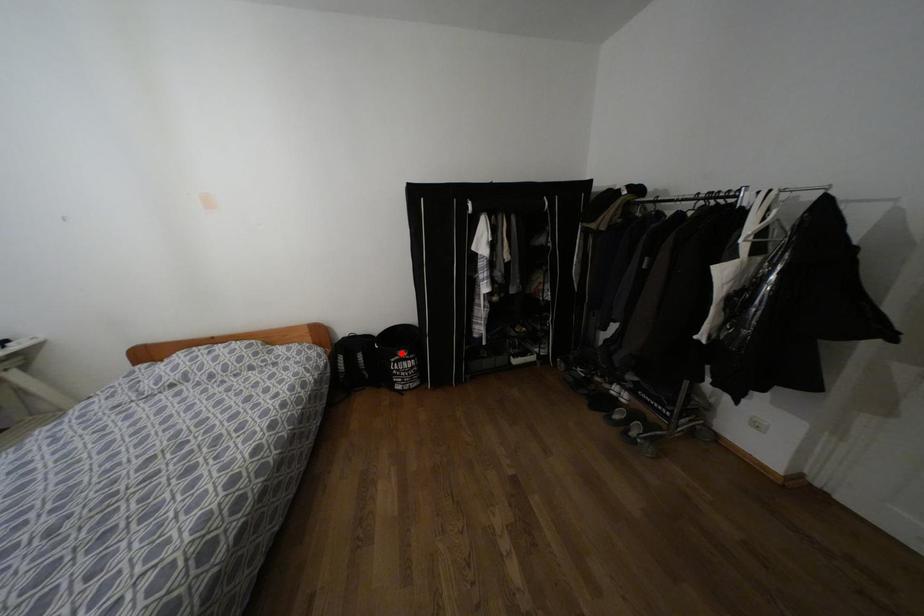
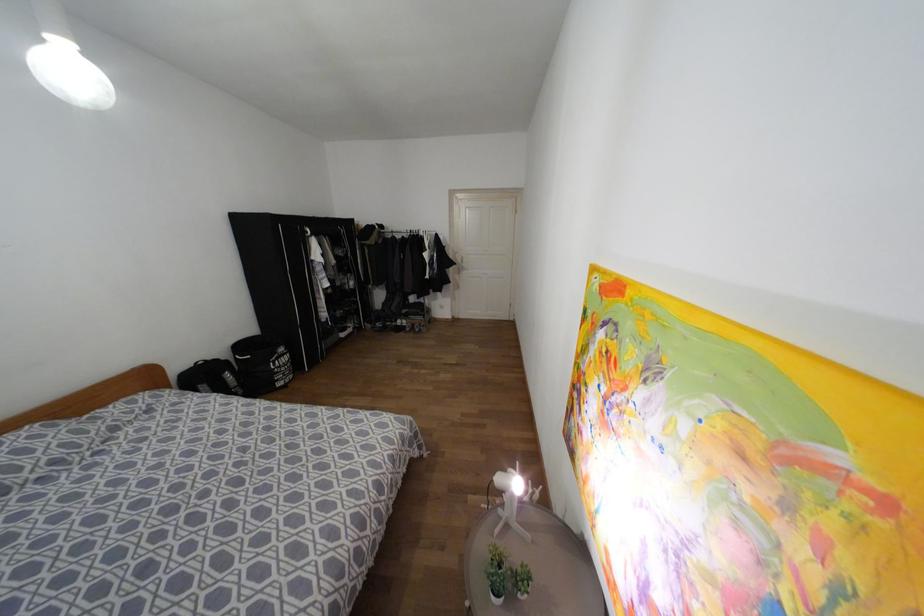
Where in the second image is the point corresponding to the highlighted location from the first image?

(281, 349)